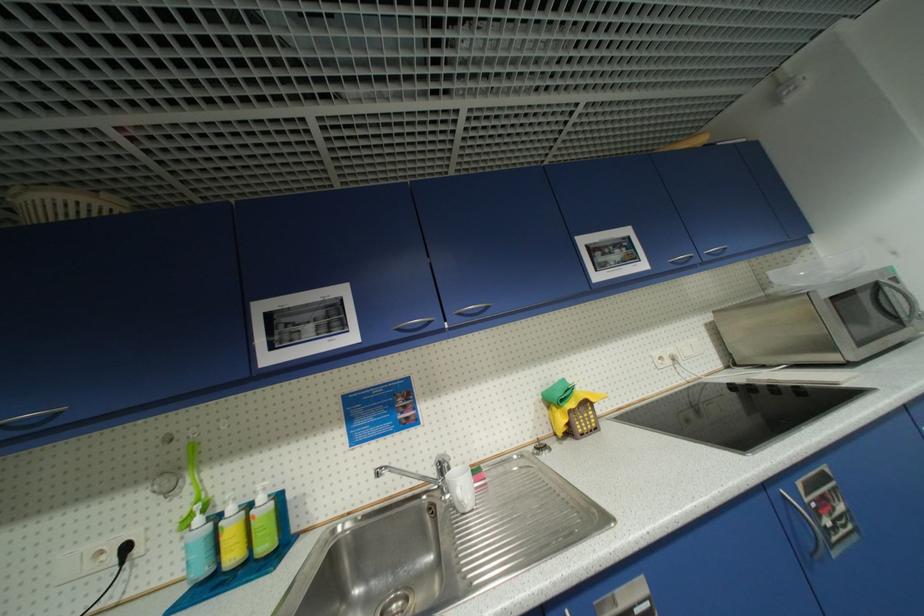
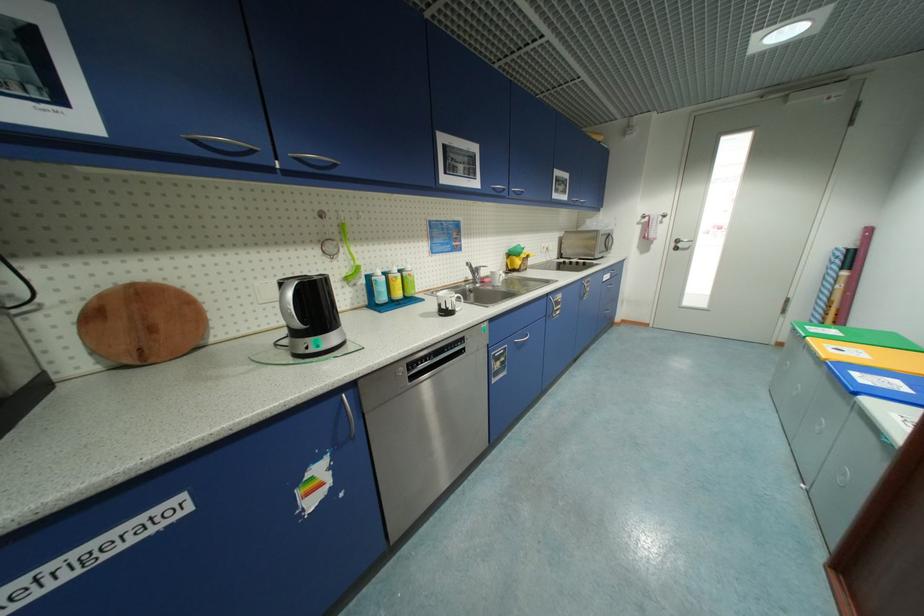
Where in the second image is the point corresponding to pixel 195 480 from the first image?

(347, 251)